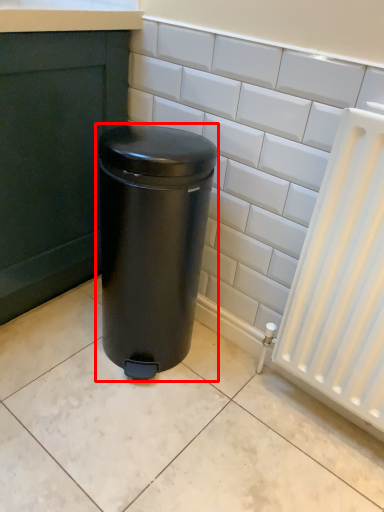
Question: From the image's perspective, what is the correct spatial positioning of waste container (annotated by the red box) in reference to ceramic tile?

Choices:
 (A) above
 (B) below

Answer: (B)